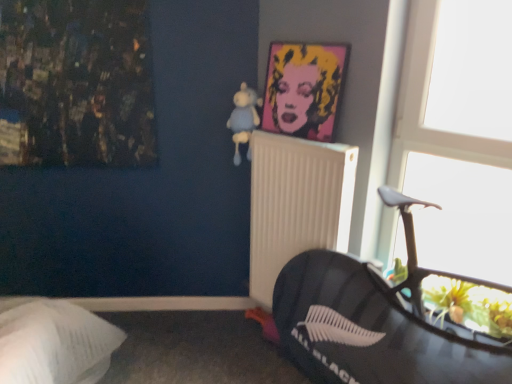
Question: Does white plastic radiator at center have a larger size compared to light blue plush at upper center?

Choices:
 (A) yes
 (B) no

Answer: (A)

Question: Considering the relative sizes of white plastic radiator at center and light blue plush at upper center in the image provided, is white plastic radiator at center wider than light blue plush at upper center?

Choices:
 (A) yes
 (B) no

Answer: (B)

Question: From the image's perspective, would you say white plastic radiator at center is shown under light blue plush at upper center?

Choices:
 (A) yes
 (B) no

Answer: (A)

Question: Can you confirm if white plastic radiator at center is positioned to the right of light blue plush at upper center?

Choices:
 (A) yes
 (B) no

Answer: (A)

Question: Is white plastic radiator at center positioned in front of light blue plush at upper center?

Choices:
 (A) no
 (B) yes

Answer: (B)

Question: Is the position of white plastic radiator at center more distant than that of light blue plush at upper center?

Choices:
 (A) yes
 (B) no

Answer: (B)

Question: Considering the relative sizes of light blue plush at upper center and pop art portrait at upper center in the image provided, is light blue plush at upper center taller than pop art portrait at upper center?

Choices:
 (A) yes
 (B) no

Answer: (B)

Question: Is light blue plush at upper center thinner than pop art portrait at upper center?

Choices:
 (A) yes
 (B) no

Answer: (B)

Question: From a real-world perspective, does light blue plush at upper center sit lower than pop art portrait at upper center?

Choices:
 (A) no
 (B) yes

Answer: (B)

Question: Is light blue plush at upper center oriented away from pop art portrait at upper center?

Choices:
 (A) yes
 (B) no

Answer: (B)

Question: Is light blue plush at upper center bigger than pop art portrait at upper center?

Choices:
 (A) no
 (B) yes

Answer: (A)

Question: Is light blue plush at upper center positioned behind pop art portrait at upper center?

Choices:
 (A) yes
 (B) no

Answer: (A)

Question: Considering the relative sizes of white plastic radiator at center and pop art portrait at upper center in the image provided, is white plastic radiator at center taller than pop art portrait at upper center?

Choices:
 (A) no
 (B) yes

Answer: (B)